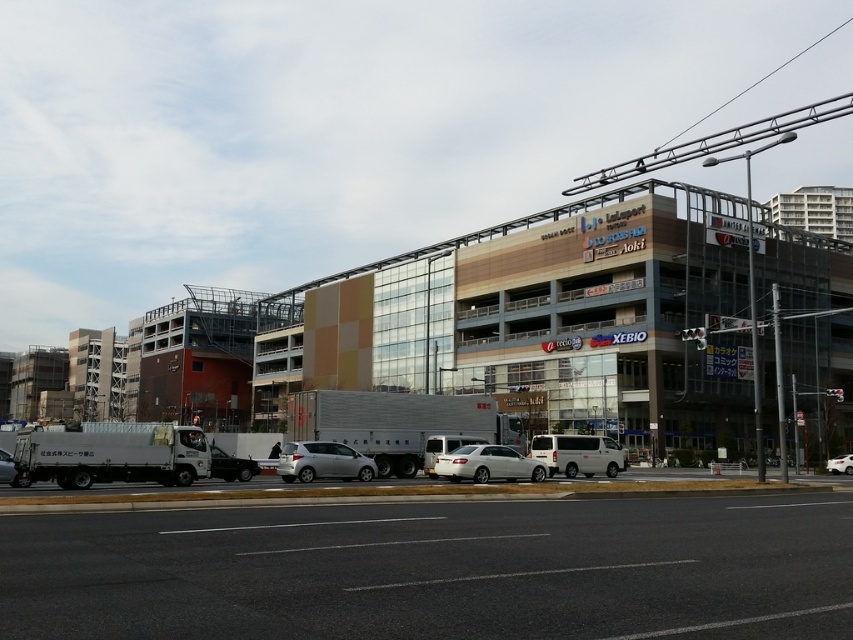
Question: Can you confirm if white matte truck at lower left is positioned above satin black sedan at center?

Choices:
 (A) no
 (B) yes

Answer: (B)

Question: Does white matte truck at lower left have a smaller size compared to satin silver sedan at center?

Choices:
 (A) no
 (B) yes

Answer: (A)

Question: Which point appears farthest from the camera in this image?

Choices:
 (A) (606, 465)
 (B) (451, 481)
 (C) (837, 456)

Answer: (C)

Question: Which object is farther from the camera taking this photo?

Choices:
 (A) white glossy sedan at center
 (B) silver metallic truck at center

Answer: (A)

Question: Which point is farther from the camera taking this photo?

Choices:
 (A) (254, 461)
 (B) (538, 451)
 (C) (846, 465)
 (D) (344, 470)

Answer: (C)

Question: Is silver metallic truck at center closer to the viewer compared to satin silver car at center?

Choices:
 (A) yes
 (B) no

Answer: (B)